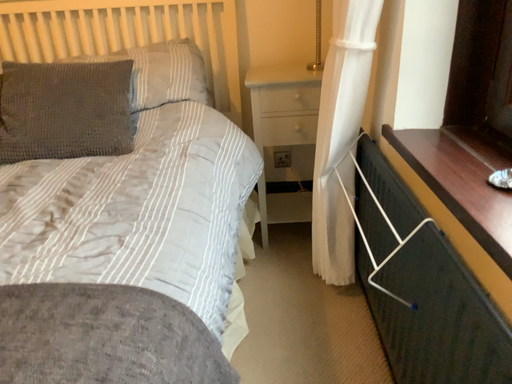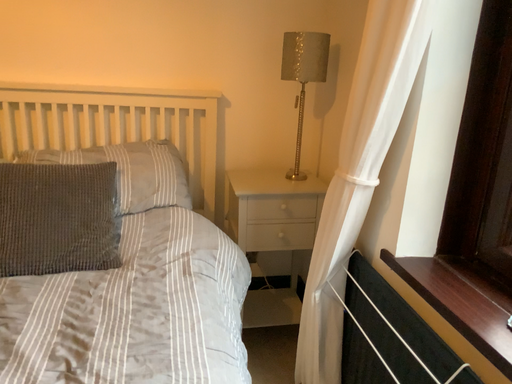
Question: How did the camera likely rotate when shooting the video?

Choices:
 (A) rotated right
 (B) rotated left

Answer: (A)